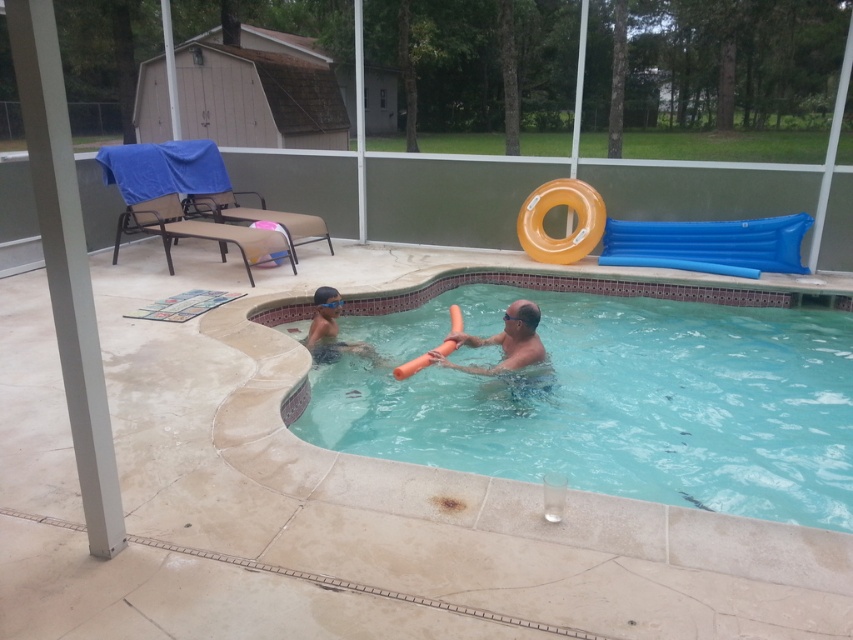
Who is positioned more to the left, clear plastic pool at center or light blue swim cap at upper center?

light blue swim cap at upper center is more to the left.

Who is taller, clear plastic pool at center or light blue swim cap at upper center?

Standing taller between the two is clear plastic pool at center.

This screenshot has width=853, height=640. Identify the location of clear plastic pool at center. (613, 394).

Is orange foam float at center thinner than light blue swim cap at upper center?

Incorrect, orange foam float at center's width is not less than light blue swim cap at upper center's.

Is orange foam float at center further to the viewer compared to light blue swim cap at upper center?

That is False.

Is point (502, 371) farther from camera compared to point (337, 292)?

No, (502, 371) is in front of (337, 292).

Find the location of `orange foam float at center`. orange foam float at center is located at coordinates (509, 352).

Can you confirm if clear plastic pool at center is positioned below orange foam float at center?

Yes.

Which is more to the left, clear plastic pool at center or orange foam float at center?

orange foam float at center is more to the left.

This screenshot has width=853, height=640. What do you see at coordinates (613, 394) in the screenshot?
I see `clear plastic pool at center` at bounding box center [613, 394].

What are the coordinates of `clear plastic pool at center` in the screenshot? It's located at (613, 394).